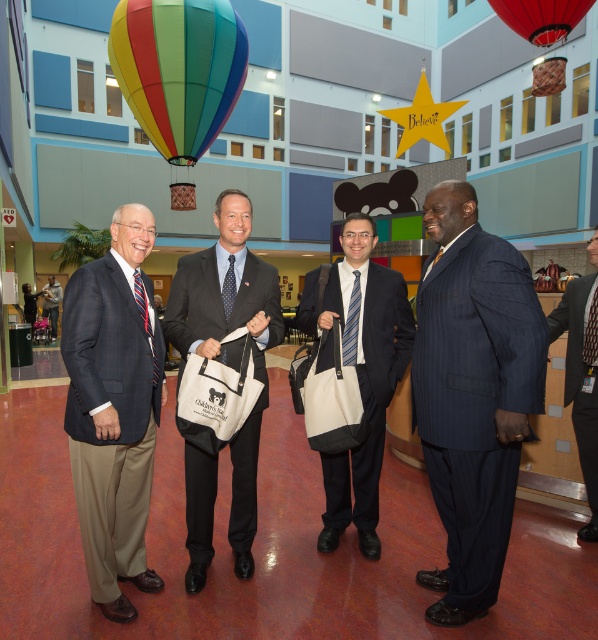
Question: In this image, where is matte white bag at center located relative to rainbow fabric balloon at upper left?

Choices:
 (A) above
 (B) below

Answer: (B)

Question: Which object appears closest to the camera in this image?

Choices:
 (A) matte white bag at center
 (B) rainbow fabric balloon at upper left

Answer: (A)

Question: Among these objects, which one is nearest to the camera?

Choices:
 (A) red fabric balloon at upper center
 (B) rainbow fabric balloon at upper left
 (C) dark blue pinstripe suit at right
 (D) matte black suit at left

Answer: (D)

Question: Is dark blue pinstripe suit at center below matte black bag at center?

Choices:
 (A) yes
 (B) no

Answer: (A)

Question: Is matte white bag at center thinner than matte black suit at center?

Choices:
 (A) no
 (B) yes

Answer: (B)

Question: Among these points, which one is farthest from the camera?

Choices:
 (A) (581, 417)
 (B) (212, 36)

Answer: (B)